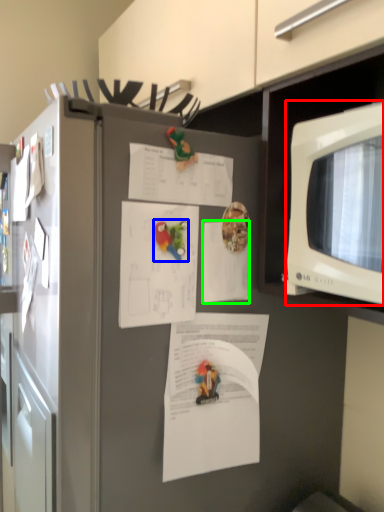
Question: Based on their relative distances, which object is farther from microwave oven (highlighted by a red box)? Choose from toy (highlighted by a blue box) and document (highlighted by a green box).

Choices:
 (A) toy
 (B) document

Answer: (A)